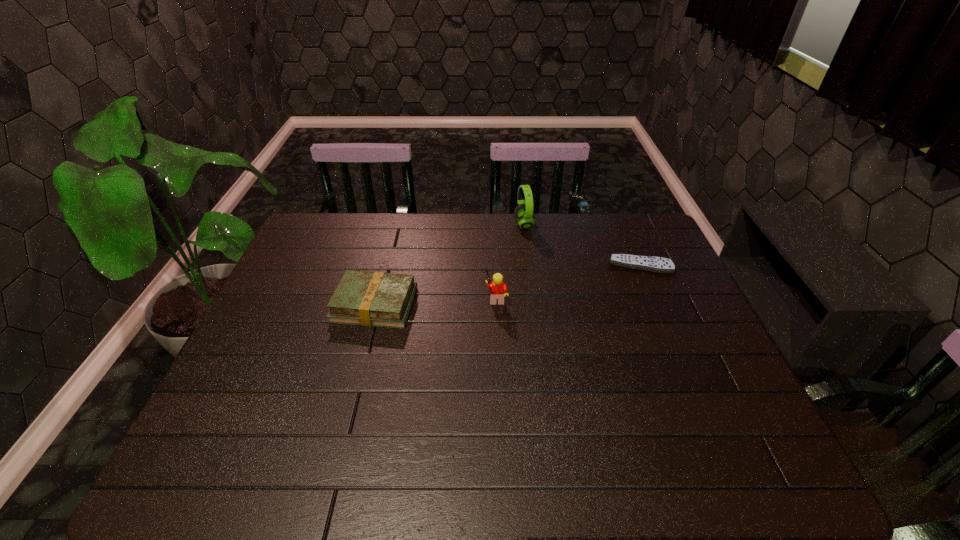
The width and height of the screenshot is (960, 540). In order to click on headset in this screenshot , I will do `click(523, 213)`.

Where is `the third object from left to right`? This screenshot has height=540, width=960. the third object from left to right is located at coordinates (523, 213).

Identify the location of the third object from right to left. point(498,289).

Find the location of `Lego`. Lego is located at coordinates (498, 289).

I want to click on the leftmost object, so click(x=379, y=299).

The width and height of the screenshot is (960, 540). In order to click on book in this screenshot , I will do `click(379, 299)`.

This screenshot has height=540, width=960. I want to click on the second farthest object, so click(x=648, y=263).

Locate an element on the screen. This screenshot has width=960, height=540. the shortest object is located at coordinates (648, 263).

The image size is (960, 540). Identify the location of free region located on the right of the headset. tap(644, 225).

Find the location of a particular element. vacant space located in front of the Lego with the accessory visible is located at coordinates pyautogui.click(x=409, y=298).